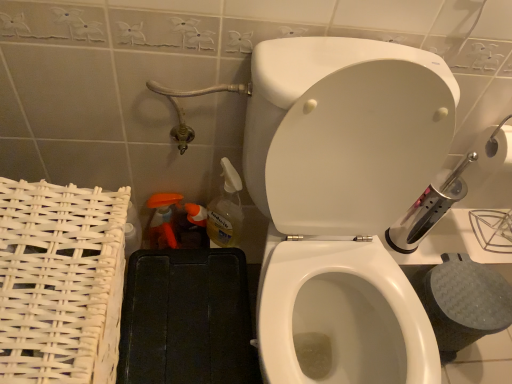
Question: Is translucent plastic spray bottle at lower center, which is the 3th cleaning product from left to right, at the back of translucent plastic spray bottle at lower left, which is counted as the 3th cleaning product, starting from the right?

Choices:
 (A) no
 (B) yes

Answer: (A)

Question: Is translucent plastic spray bottle at lower left, which is counted as the 1th cleaning product, starting from the left, at the left side of translucent plastic spray bottle at lower center, which is the 3th cleaning product from left to right?

Choices:
 (A) yes
 (B) no

Answer: (A)

Question: Considering the relative sizes of translucent plastic spray bottle at lower left, which is counted as the 1th cleaning product, starting from the left, and translucent plastic spray bottle at lower center, placed as the 1th cleaning product when sorted from right to left, in the image provided, is translucent plastic spray bottle at lower left, which is counted as the 1th cleaning product, starting from the left, smaller than translucent plastic spray bottle at lower center, placed as the 1th cleaning product when sorted from right to left,?

Choices:
 (A) no
 (B) yes

Answer: (B)

Question: Does translucent plastic spray bottle at lower left, which is counted as the 1th cleaning product, starting from the left, have a lesser height compared to translucent plastic spray bottle at lower center, placed as the 1th cleaning product when sorted from right to left?

Choices:
 (A) yes
 (B) no

Answer: (A)

Question: From a real-world perspective, is translucent plastic spray bottle at lower left, which is counted as the 3th cleaning product, starting from the right, under translucent plastic spray bottle at lower center, placed as the 1th cleaning product when sorted from right to left?

Choices:
 (A) yes
 (B) no

Answer: (A)

Question: Does translucent plastic spray bottle at lower left, which is counted as the 1th cleaning product, starting from the left, contain translucent plastic spray bottle at lower center, which is the 3th cleaning product from left to right?

Choices:
 (A) no
 (B) yes

Answer: (A)

Question: Can you confirm if white glossy toilet at center is thinner than translucent plastic spray bottle at lower center, which is the 3th cleaning product from left to right?

Choices:
 (A) no
 (B) yes

Answer: (A)

Question: Is white glossy toilet at center oriented towards translucent plastic spray bottle at lower center, which is the 3th cleaning product from left to right?

Choices:
 (A) no
 (B) yes

Answer: (A)

Question: Would you consider white glossy toilet at center to be distant from translucent plastic spray bottle at lower center, which is the 3th cleaning product from left to right?

Choices:
 (A) no
 (B) yes

Answer: (A)

Question: Is white glossy toilet at center further to camera compared to translucent plastic spray bottle at lower center, which is the 3th cleaning product from left to right?

Choices:
 (A) yes
 (B) no

Answer: (B)

Question: From the image's perspective, is white glossy toilet at center located beneath translucent plastic spray bottle at lower center, which is the 3th cleaning product from left to right?

Choices:
 (A) yes
 (B) no

Answer: (A)

Question: Is the position of white glossy toilet at center less distant than that of translucent plastic spray bottle at lower center, placed as the 1th cleaning product when sorted from right to left?

Choices:
 (A) yes
 (B) no

Answer: (A)

Question: Is white glossy toilet at center oriented away from translucent plastic spray bottle at lower left, which is counted as the 3th cleaning product, starting from the right?

Choices:
 (A) yes
 (B) no

Answer: (B)